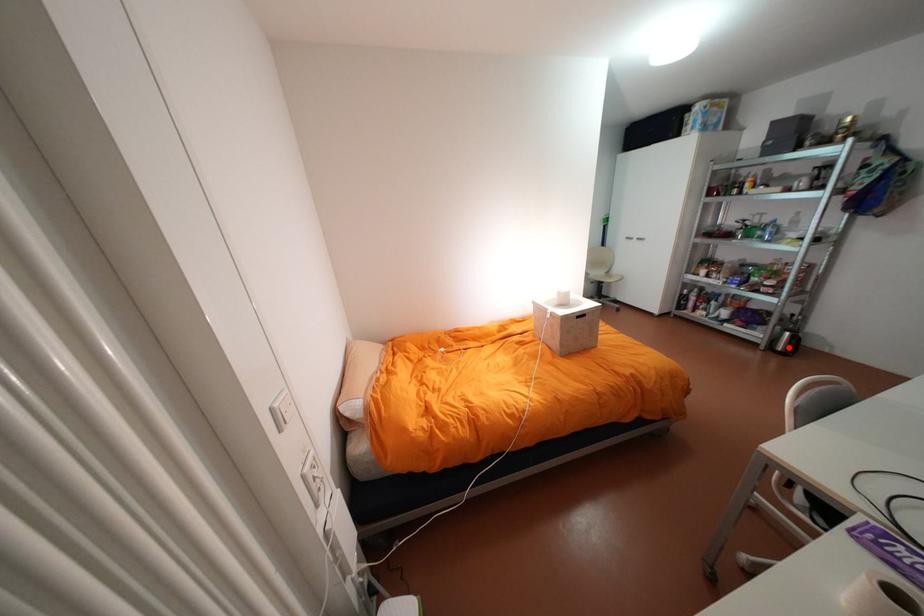
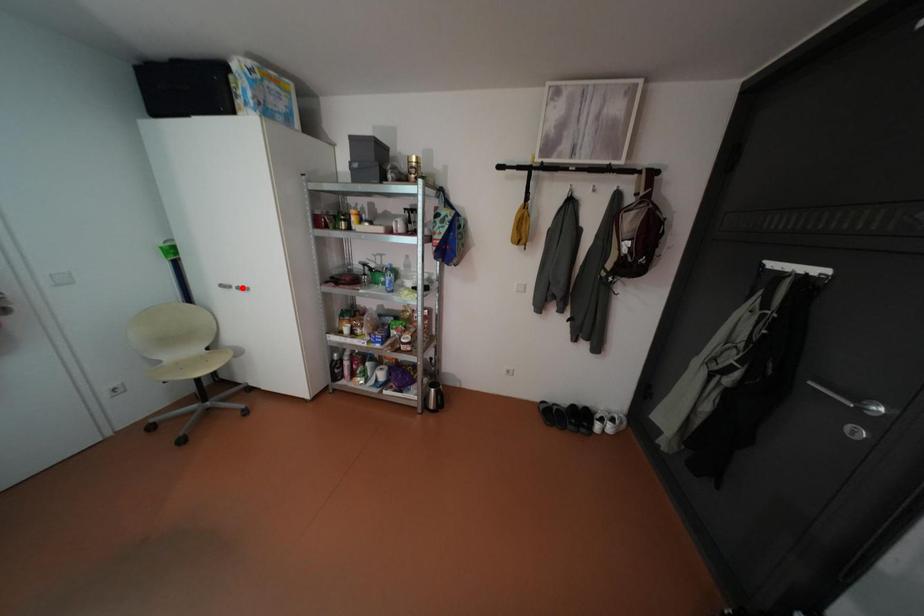
I am providing you with two images of the same scene from different viewpoints. A red point is marked on the first image and another point is marked on the second image. Is the marked point in image1 the same physical position as the marked point in image2?

No